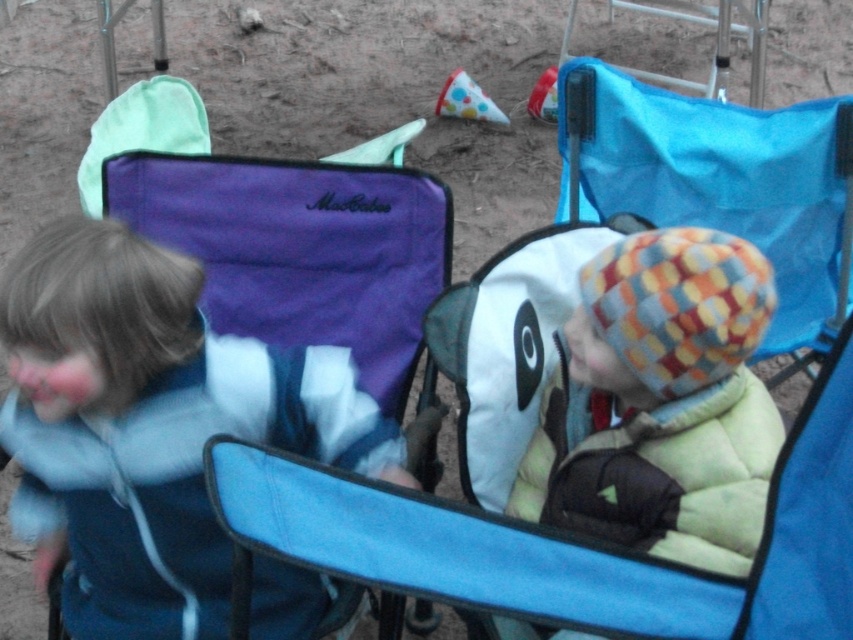
You are a delivery robot that needs to place a small package between the matte blue jacket at left and the blue fabric folding chair at center. The package is 12 inches long. Is there enough space between them for the package?

The distance between the matte blue jacket at left and the blue fabric folding chair at center is 35.65 inches, which is more than the 12 inches required for the package. Therefore, there is enough space to place the package between them.

Looking at this image, you are standing at the camera position and want to reach the point marked as point [186,323]. If you take 3 steps each of 2 feet, will you reach the point?

The distance between point [186,323] and the camera is 5.67 feet. Taking 3 steps of 2 feet each covers 6 feet, so you will pass the point by 0.33 feet.